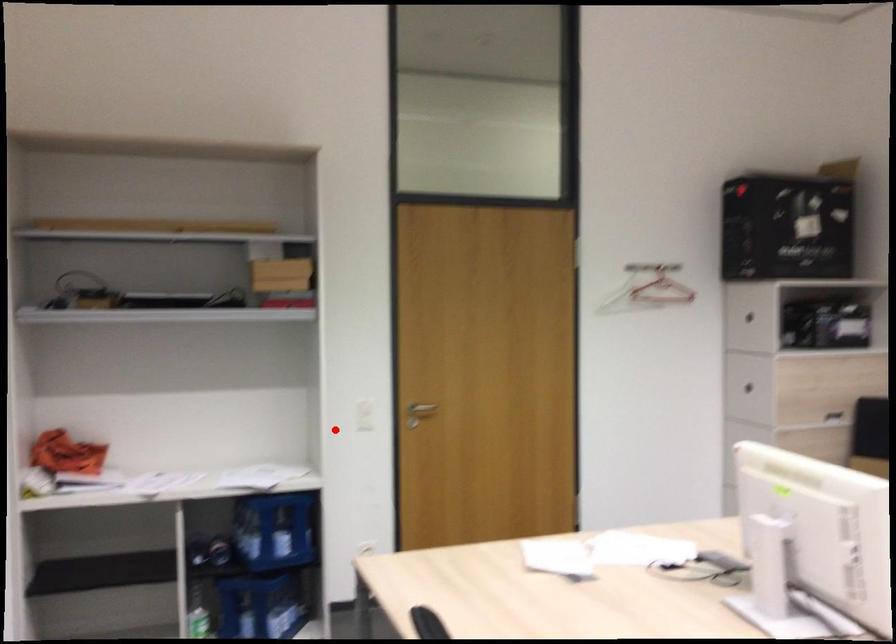
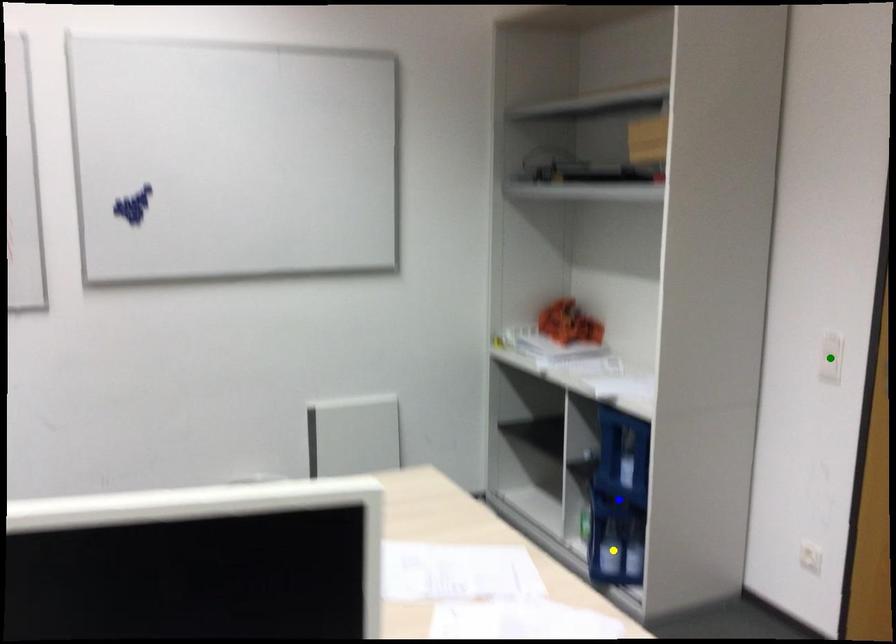
Question: I am providing you with two images of the same scene from different viewpoints. A red point is marked on the first image. You are given multiple points on the second image. Which point in image 2 represents the same 3d spot as the red point in image 1?

Choices:
 (A) blue point
 (B) green point
 (C) yellow point

Answer: (B)